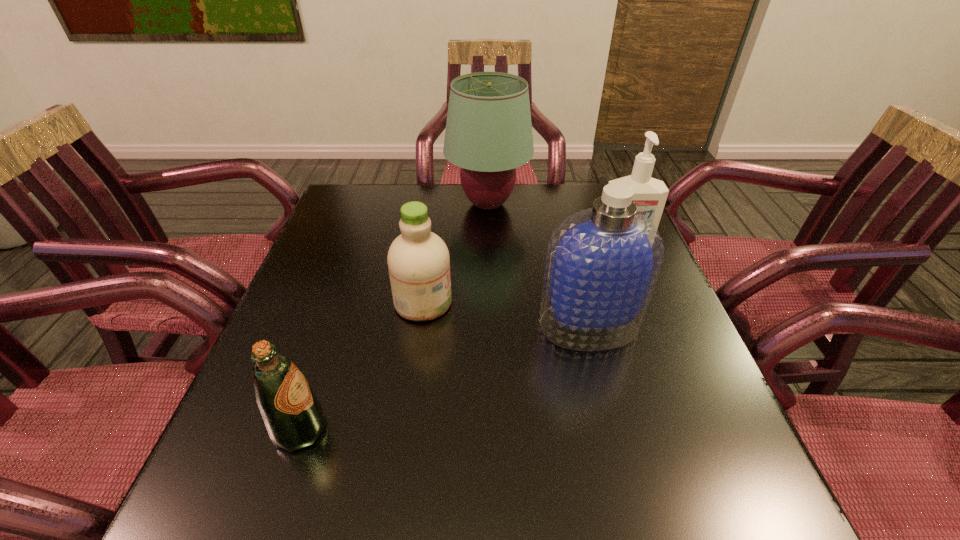
Where is `the farthest object`? the farthest object is located at coordinates (488, 134).

At what (x,y) coordinates should I click in order to perform the action: click on the fourth nearest object. Please return your answer as a coordinate pair (x, y). The image size is (960, 540). Looking at the image, I should click on (650, 194).

The width and height of the screenshot is (960, 540). What are the coordinates of `the leftmost cleansing agent` in the screenshot? It's located at [x=418, y=260].

Where is `the nearest object`? The width and height of the screenshot is (960, 540). the nearest object is located at coordinates (293, 416).

Where is `olive oil`? olive oil is located at coordinates (293, 416).

Locate an element on the screen. The width and height of the screenshot is (960, 540). vacant space located on the right of the farthest object is located at coordinates (565, 204).

The height and width of the screenshot is (540, 960). I want to click on vacant space located on the front label of the second farthest object, so click(x=632, y=271).

Locate an element on the screen. vacant space situated 0.070m on the front label of the leftmost cleansing agent is located at coordinates (482, 302).

This screenshot has height=540, width=960. Identify the location of free spot located on the front-facing side of the nearest object. (418, 430).

Find the location of a particular element. This screenshot has width=960, height=540. object at the far edge is located at coordinates (488, 134).